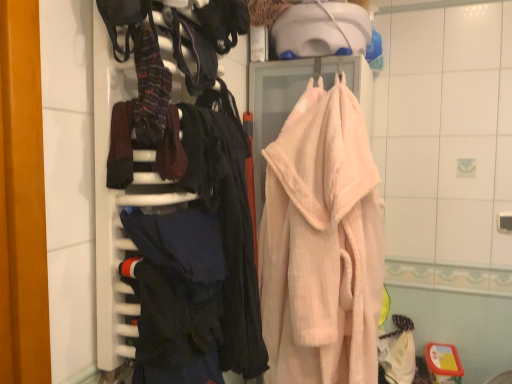
Question: Can you confirm if dark blue fabric at left is positioned to the left of striped wool socks at upper left, placed as the 1th clothing when sorted from top to bottom?

Choices:
 (A) yes
 (B) no

Answer: (B)

Question: From the image's perspective, does dark blue fabric at left appear higher than striped wool socks at upper left, placed as the 1th clothing when sorted from top to bottom?

Choices:
 (A) no
 (B) yes

Answer: (A)

Question: Can you confirm if dark blue fabric at left is smaller than striped wool socks at upper left, which appears as the 2th clothing when ordered from the bottom?

Choices:
 (A) no
 (B) yes

Answer: (A)

Question: From a real-world perspective, does dark blue fabric at left stand above striped wool socks at upper left, which appears as the 2th clothing when ordered from the bottom?

Choices:
 (A) yes
 (B) no

Answer: (B)

Question: Would you say dark blue fabric at left contains striped wool socks at upper left, which appears as the 2th clothing when ordered from the bottom?

Choices:
 (A) no
 (B) yes

Answer: (B)

Question: Is dark blue fabric at center, the 1th clothing in the bottom-to-top sequence, wider or thinner than pink fluffy bathrobe at center?

Choices:
 (A) thin
 (B) wide

Answer: (A)

Question: From the image's perspective, is dark blue fabric at center, the 1th clothing in the bottom-to-top sequence, located above or below pink fluffy bathrobe at center?

Choices:
 (A) below
 (B) above

Answer: (A)

Question: Considering the relative positions of dark blue fabric at center, the 1th clothing in the bottom-to-top sequence, and pink fluffy bathrobe at center in the image provided, is dark blue fabric at center, the 1th clothing in the bottom-to-top sequence, to the left or to the right of pink fluffy bathrobe at center?

Choices:
 (A) left
 (B) right

Answer: (A)

Question: Relative to pink fluffy bathrobe at center, is dark blue fabric at center, the 1th clothing in the bottom-to-top sequence, in front or behind?

Choices:
 (A) front
 (B) behind

Answer: (A)

Question: From a real-world perspective, relative to dark blue fabric at left, is striped wool socks at upper left, which appears as the 2th clothing when ordered from the bottom, vertically above or below?

Choices:
 (A) below
 (B) above

Answer: (B)

Question: Does point (144, 48) appear closer or farther from the camera than point (170, 157)?

Choices:
 (A) farther
 (B) closer

Answer: (B)

Question: Looking at the image, does striped wool socks at upper left, which appears as the 2th clothing when ordered from the bottom, seem bigger or smaller compared to dark blue fabric at left?

Choices:
 (A) small
 (B) big

Answer: (A)

Question: From the image's perspective, is striped wool socks at upper left, placed as the 1th clothing when sorted from top to bottom, above or below dark blue fabric at left?

Choices:
 (A) below
 (B) above

Answer: (B)

Question: From the image's perspective, is pink fluffy bathrobe at center above or below dark blue fabric at left?

Choices:
 (A) below
 (B) above

Answer: (A)

Question: Considering the positions of point (333, 129) and point (139, 185), is point (333, 129) closer or farther from the camera than point (139, 185)?

Choices:
 (A) closer
 (B) farther

Answer: (B)